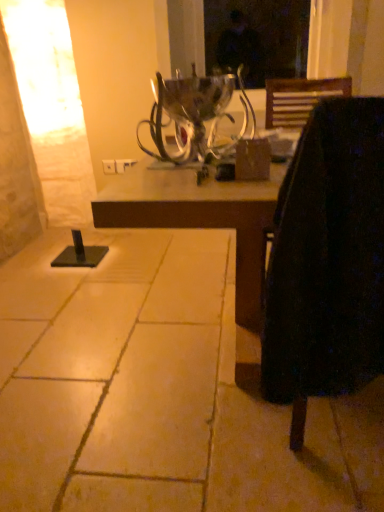
At what (x,y) coordinates should I click in order to perform the action: click on metallic silver candle holder at center. Please return your answer as a coordinate pair (x, y). Looking at the image, I should click on (194, 115).

Identify the location of black fabric chair at right. (327, 261).

What is the approximate height of black fabric chair at right?

black fabric chair at right is 28.10 inches tall.

Describe the element at coordinates (157, 391) in the screenshot. I see `brown tile floor at lower left` at that location.

Find the location of a particular element. The height and width of the screenshot is (512, 384). metallic silver candle holder at center is located at coordinates (194, 115).

Is metallic silver candle holder at center facing away from brown tile floor at lower left?

No, metallic silver candle holder at center's orientation is not away from brown tile floor at lower left.

Who is bigger, metallic silver candle holder at center or brown tile floor at lower left?

Bigger between the two is brown tile floor at lower left.

From a real-world perspective, which is physically below, metallic silver candle holder at center or brown tile floor at lower left?

brown tile floor at lower left, from a real-world perspective.

Are metallic silver candle holder at center and brown tile floor at lower left located far from each other?

metallic silver candle holder at center is near brown tile floor at lower left, not far away.

Considering the sizes of objects matte brown table at center and brown tile floor at lower left in the image provided, who is taller, matte brown table at center or brown tile floor at lower left?

Standing taller between the two is matte brown table at center.

From a real-world perspective, between matte brown table at center and brown tile floor at lower left, who is vertically higher?

matte brown table at center, from a real-world perspective.

Which object is closer to the camera taking this photo, matte brown table at center or brown tile floor at lower left?

brown tile floor at lower left is closer to the camera.

From the image's perspective, is matte brown table at center on top of brown tile floor at lower left?

Yes.

Which of these two, black fabric chair at right or brown tile floor at lower left, stands shorter?

With less height is brown tile floor at lower left.

From a real-world perspective, is black fabric chair at right above or below brown tile floor at lower left?

black fabric chair at right is situated higher than brown tile floor at lower left in the real world.

Could you tell me if black fabric chair at right is turned towards brown tile floor at lower left?

No, black fabric chair at right is not oriented towards brown tile floor at lower left.

Looking at the image, does metallic silver candle holder at center seem bigger or smaller compared to matte brown table at center?

Considering their sizes, metallic silver candle holder at center takes up less space than matte brown table at center.

The height and width of the screenshot is (512, 384). In the image, there is a matte brown table at center. Identify the location of candle holder above it (from the image's perspective). [194, 115].

From the image's perspective, is metallic silver candle holder at center located above or below matte brown table at center?

Based on their image positions, metallic silver candle holder at center is located above matte brown table at center.

What are the coordinates of `chair located above the matte brown table at center (from the image's perspective)` in the screenshot? It's located at (327, 261).

Is black fabric chair at right far from matte brown table at center?

No.

From the image's perspective, is black fabric chair at right on matte brown table at center?

Indeed, from the image's perspective, black fabric chair at right is shown above matte brown table at center.

From a real-world perspective, is brown tile floor at lower left positioned under black fabric chair at right based on gravity?

Yes.

Considering the sizes of objects brown tile floor at lower left and black fabric chair at right in the image provided, who is taller, brown tile floor at lower left or black fabric chair at right?

With more height is black fabric chair at right.

How many degrees apart are the facing directions of brown tile floor at lower left and black fabric chair at right?

The angular difference between brown tile floor at lower left and black fabric chair at right is 91.5 degrees.

Is brown tile floor at lower left looking in the opposite direction of black fabric chair at right?

No, brown tile floor at lower left's orientation is not away from black fabric chair at right.

Which of these two, brown tile floor at lower left or metallic silver candle holder at center, is wider?

brown tile floor at lower left.

Is brown tile floor at lower left facing away from metallic silver candle holder at center?

No.

Which is more to the right, brown tile floor at lower left or metallic silver candle holder at center?

Positioned to the right is metallic silver candle holder at center.

Is brown tile floor at lower left outside of metallic silver candle holder at center?

brown tile floor at lower left is positioned outside metallic silver candle holder at center.

Find the location of a particular element. Image resolution: width=384 pixels, height=512 pixels. concrete that appears on the left of metallic silver candle holder at center is located at coordinates (157, 391).

This screenshot has width=384, height=512. I want to click on table located above the brown tile floor at lower left (from the image's perspective), so click(x=200, y=218).

Estimate the real-world distances between objects in this image. Which object is closer to metallic silver candle holder at center, black fabric chair at right or matte brown table at center?

The object closer to metallic silver candle holder at center is matte brown table at center.

Estimate the real-world distances between objects in this image. Which object is closer to metallic silver candle holder at center, matte brown table at center or black fabric chair at right?

matte brown table at center lies closer to metallic silver candle holder at center than the other object.

Considering their positions, is brown tile floor at lower left positioned closer to metallic silver candle holder at center than black fabric chair at right?

brown tile floor at lower left is closer to metallic silver candle holder at center.

Estimate the real-world distances between objects in this image. Which object is further from matte brown table at center, brown tile floor at lower left or metallic silver candle holder at center?

Among the two, metallic silver candle holder at center is located further to matte brown table at center.

Estimate the real-world distances between objects in this image. Which object is further from black fabric chair at right, matte brown table at center or brown tile floor at lower left?

The object further to black fabric chair at right is brown tile floor at lower left.

Based on their spatial positions, is black fabric chair at right or brown tile floor at lower left further from metallic silver candle holder at center?

black fabric chair at right.

From the image, which object appears to be nearer to brown tile floor at lower left, matte brown table at center or black fabric chair at right?

Based on the image, matte brown table at center appears to be nearer to brown tile floor at lower left.

Estimate the real-world distances between objects in this image. Which object is closer to black fabric chair at right, matte brown table at center or metallic silver candle holder at center?

Based on the image, matte brown table at center appears to be nearer to black fabric chair at right.

Locate an element on the screen. This screenshot has height=512, width=384. table between brown tile floor at lower left and black fabric chair at right from left to right is located at coordinates (200, 218).

Locate an element on the screen. This screenshot has height=512, width=384. table between metallic silver candle holder at center and brown tile floor at lower left vertically is located at coordinates (200, 218).

Where is `table between black fabric chair at right and metallic silver candle holder at center along the z-axis`? table between black fabric chair at right and metallic silver candle holder at center along the z-axis is located at coordinates (200, 218).

Locate an element on the screen. The width and height of the screenshot is (384, 512). candle holder between brown tile floor at lower left and black fabric chair at right from left to right is located at coordinates (194, 115).